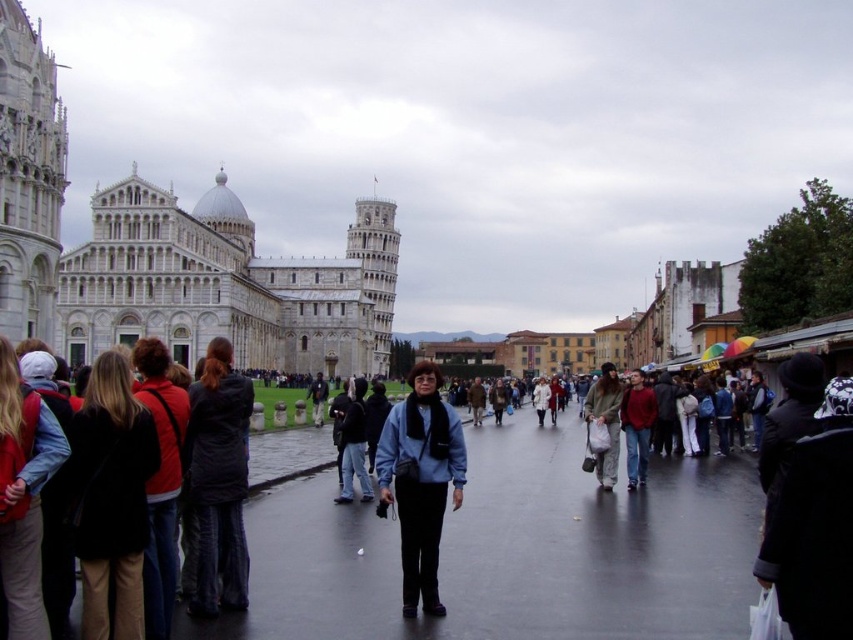
You are a tour guide standing at the point labeled point (340, 426). You notice a tourist at point (149, 369) who is trying to take a photo of the Leaning Tower of Pisa. Can you determine if the tourist is positioned in front of or behind you?

Point (149, 369) is in front of point (340, 426), so the tourist is positioned in front of you.

You are a photographer trying to capture the entire white stone tower at center and the matte gray jacket at center in a single shot. Based on their sizes in the image, which object would require you to adjust your camera settings to ensure both are fully visible?

The white stone tower at center is smaller than the matte gray jacket at center. To capture both in a single shot, you would need to adjust your camera settings to accommodate the larger size of the matte gray jacket at center, ensuring it fits within the frame while still including the smaller white stone tower at center.